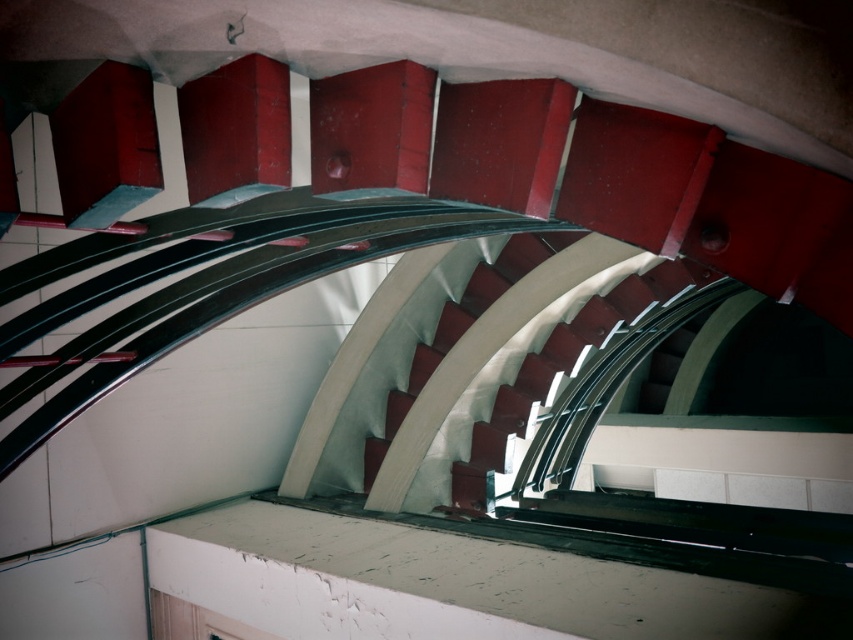
Question: Can you confirm if smooth white stair at center is positioned to the right of white glossy stair at center?

Choices:
 (A) no
 (B) yes

Answer: (B)

Question: Which point is closer to the camera?

Choices:
 (A) white glossy stair at center
 (B) smooth white stair at center

Answer: (B)

Question: Which point appears farthest from the camera in this image?

Choices:
 (A) (440, 356)
 (B) (598, 305)

Answer: (A)

Question: Can you confirm if smooth white stair at center is thinner than white glossy stair at center?

Choices:
 (A) yes
 (B) no

Answer: (B)

Question: Where is smooth white stair at center located in relation to white glossy stair at center in the image?

Choices:
 (A) right
 (B) left

Answer: (A)